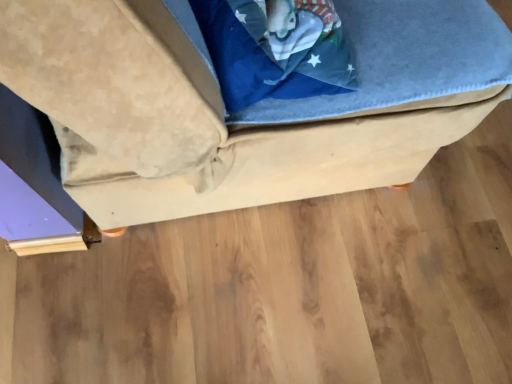
The image size is (512, 384). I want to click on vacant area that lies in front of suede-like beige ottoman at center, so click(278, 299).